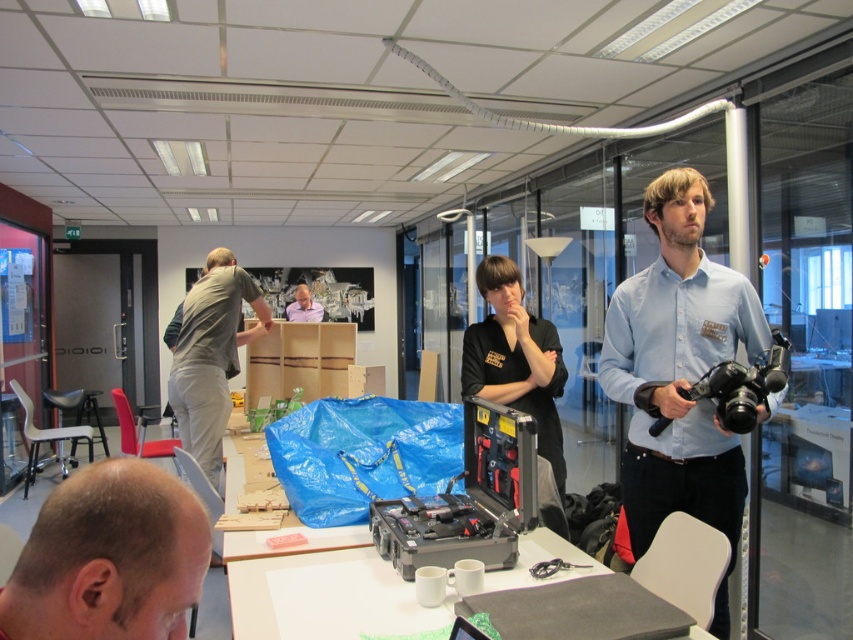
Where is `white matte table at center`? This screenshot has width=853, height=640. white matte table at center is located at coordinates (325, 596).

The width and height of the screenshot is (853, 640). I want to click on white matte table at center, so click(x=325, y=596).

At what (x,y) coordinates should I click in order to perform the action: click on white matte table at center. Please return your answer as a coordinate pair (x, y). The image size is (853, 640). Looking at the image, I should click on (325, 596).

Is point (90, 611) positioned in front of point (788, 358)?

Yes.

The height and width of the screenshot is (640, 853). What do you see at coordinates (109, 557) in the screenshot? I see `bald head at lower left` at bounding box center [109, 557].

This screenshot has height=640, width=853. I want to click on bald head at lower left, so click(x=109, y=557).

Between bald head at lower left and white matte table at center, which one is positioned higher?

bald head at lower left is higher up.

Which is in front, point (99, 516) or point (438, 618)?

Point (99, 516)

You are a GUI agent. You are given a task and a screenshot of the screen. Output one action in this format:
    pyautogui.click(x=<x>, y=<y>)
    Task: Click on the bald head at lower left
    This screenshot has height=640, width=853.
    Given the screenshot: What is the action you would take?
    pyautogui.click(x=109, y=557)

The height and width of the screenshot is (640, 853). I want to click on bald head at lower left, so click(x=109, y=557).